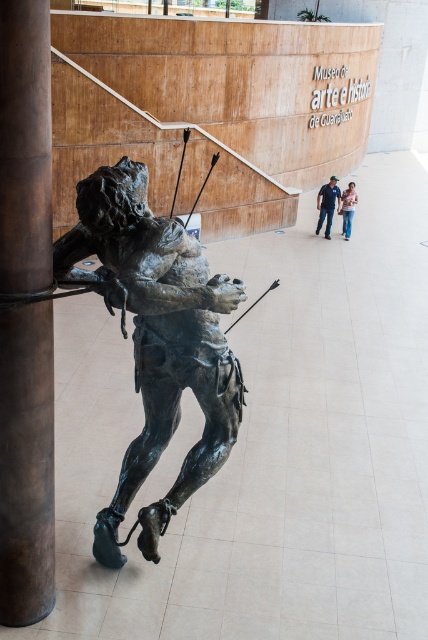
From the picture: You are a tailor measuring the distance between two pairs of jeans in a display. The blue denim jeans at lower center and the jeans at center are part of an exhibition. Can you confirm if the distance between them is sufficient to allow a 12 inch wide mannequin to stand between them without touching either pair?

The blue denim jeans at lower center and the jeans at center are 12.73 inches apart, which is more than enough space for a 12 inch wide mannequin to stand between them without touching either pair.